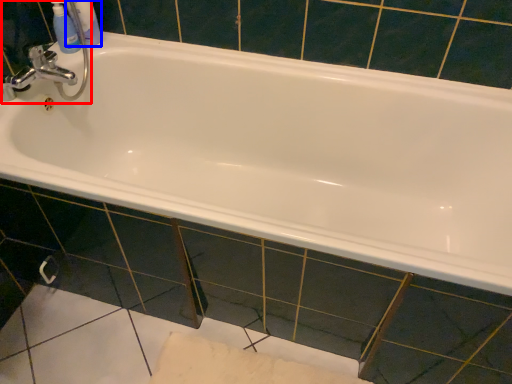
Question: Which point is further to the camera, sink (highlighted by a red box) or toiletry (highlighted by a blue box)?

Choices:
 (A) sink
 (B) toiletry

Answer: (B)